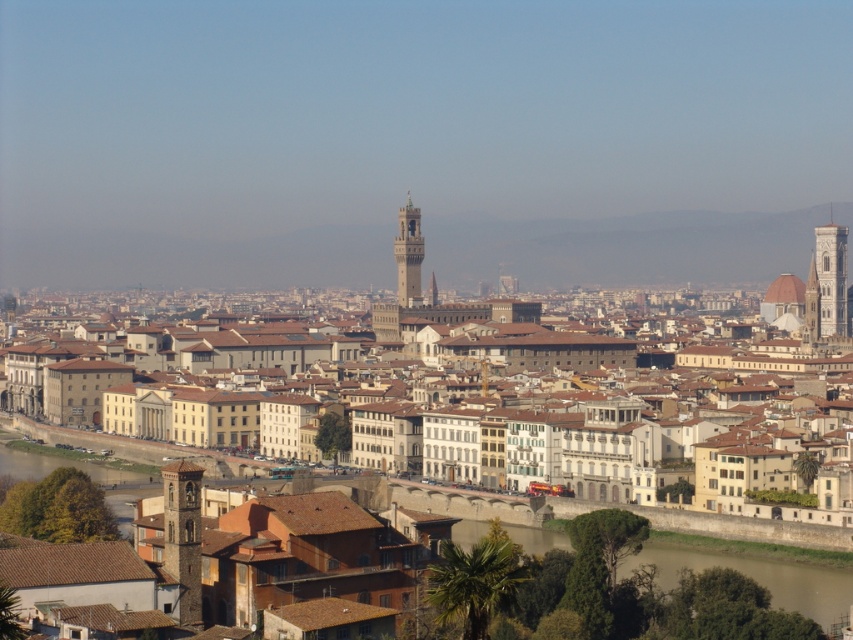
Question: Is brown stone buildings at center below stone bell tower at lower left?

Choices:
 (A) yes
 (B) no

Answer: (B)

Question: Which of the following is the closest to the observer?

Choices:
 (A) (161, 426)
 (B) (416, 224)

Answer: (A)

Question: Does brown concrete wall at lower center come in front of white marble tower at right?

Choices:
 (A) no
 (B) yes

Answer: (B)

Question: Among these points, which one is nearest to the camera?

Choices:
 (A) (846, 230)
 (B) (770, 573)
 (C) (485, 336)
 (D) (170, 554)

Answer: (D)

Question: Which point appears farthest from the camera in this image?

Choices:
 (A) (821, 266)
 (B) (543, 538)
 (C) (245, 344)

Answer: (A)

Question: Can you confirm if stone bell tower at lower left is positioned to the right of white marble tower at right?

Choices:
 (A) yes
 (B) no

Answer: (B)